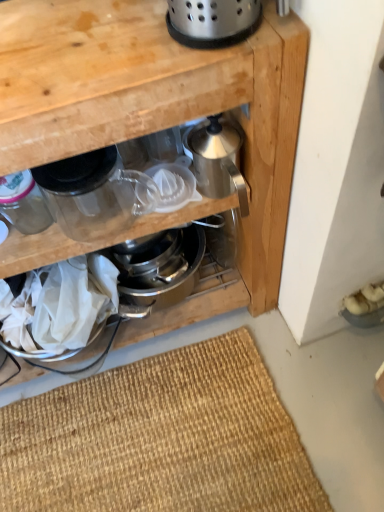
Identify the location of vacant space positioned to the left of polished stainless steel colander at upper center, marked as the second appliance in a right-to-left arrangement. (92, 42).